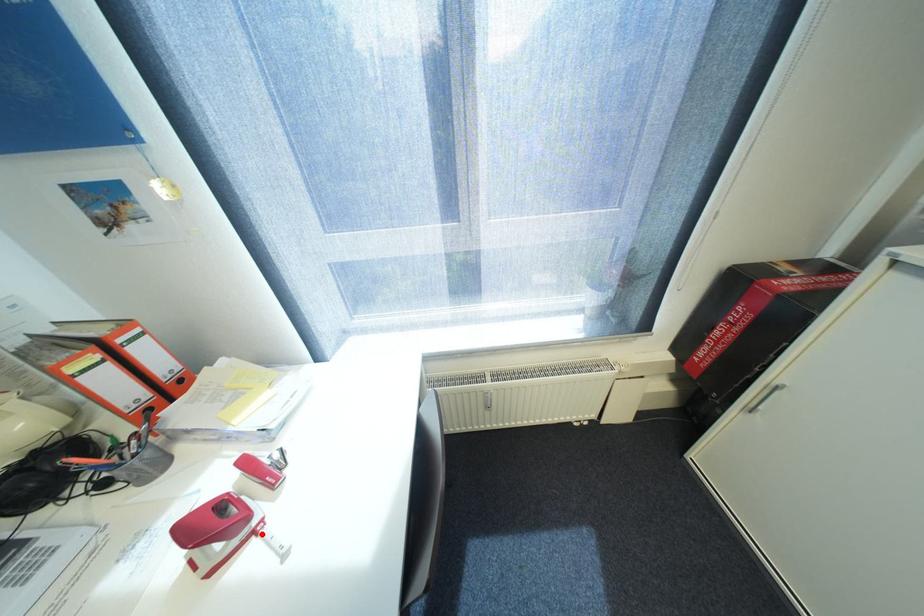
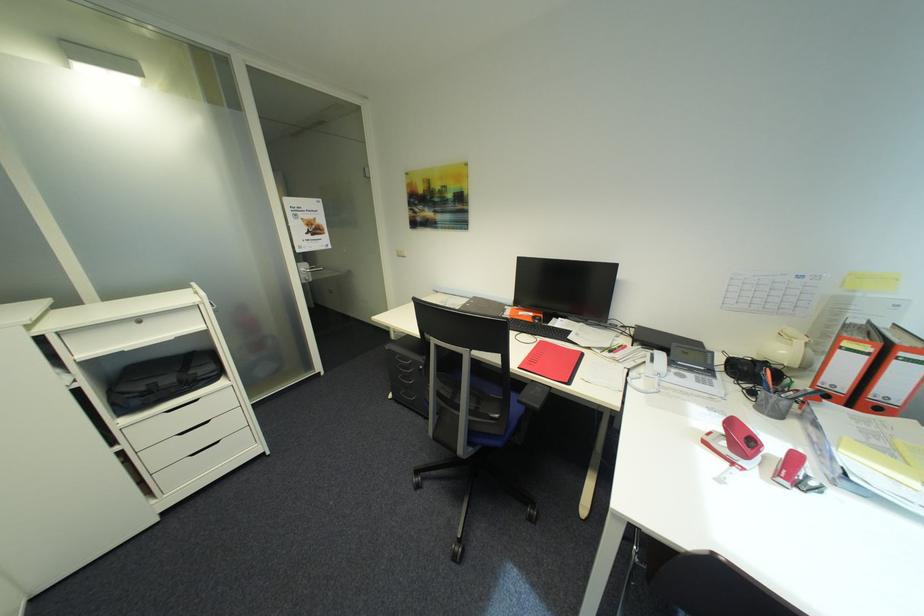
In the second image, find the point that corresponds to the highlighted location in the first image.

(742, 464)